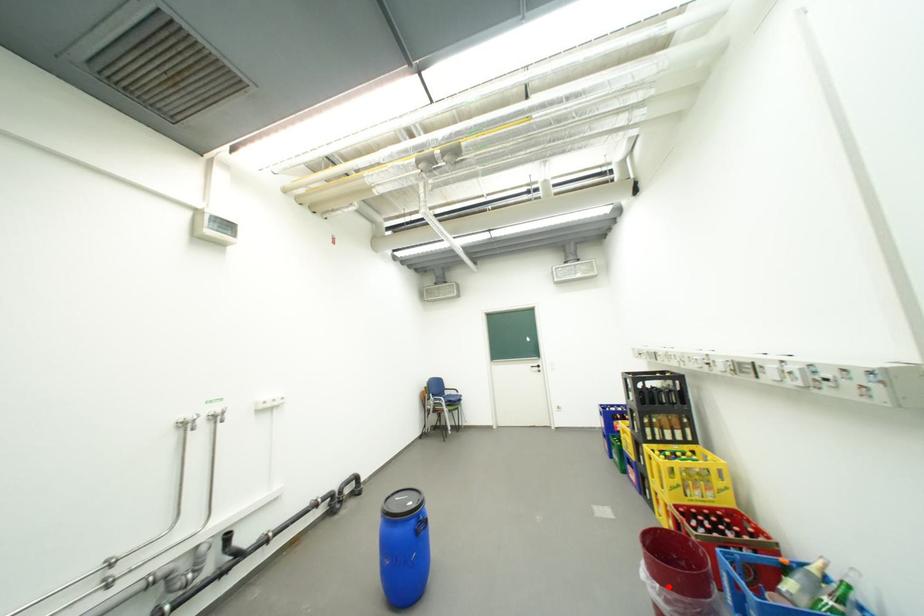
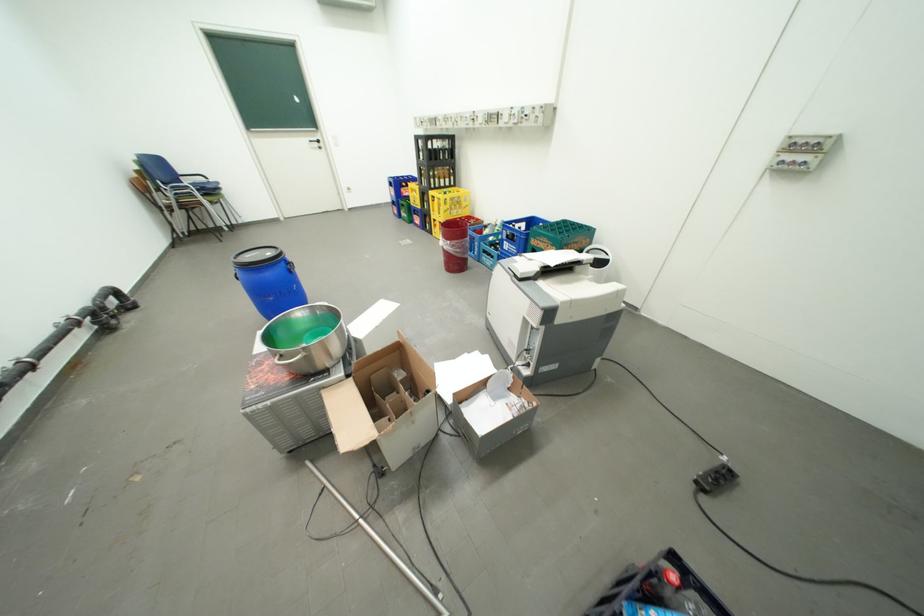
Question: A red point is marked in image1. In image2, is the corresponding 3D point closer to the camera or farther? Reply with the corresponding letter.

Choices:
 (A) The corresponding 3D point is closer.
 (B) The corresponding 3D point is farther.

Answer: (A)